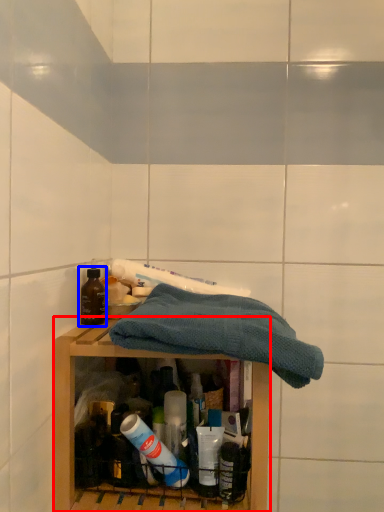
Question: Which point is further to the camera, shelf (highlighted by a red box) or bottle (highlighted by a blue box)?

Choices:
 (A) shelf
 (B) bottle

Answer: (B)